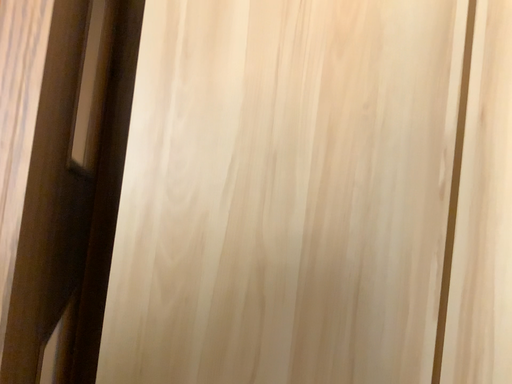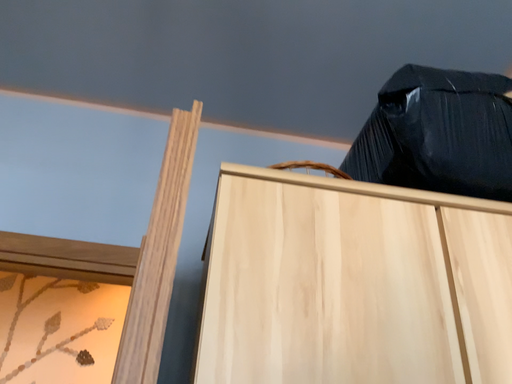
Question: Which way did the camera rotate in the video?

Choices:
 (A) rotated upward
 (B) rotated downward

Answer: (A)